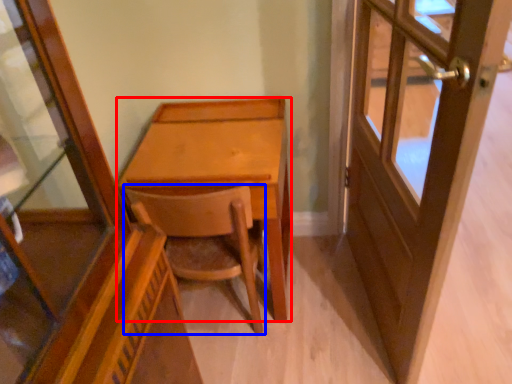
Question: Which object appears farthest to the camera in this image, desk (highlighted by a red box) or chair (highlighted by a blue box)?

Choices:
 (A) desk
 (B) chair

Answer: (A)